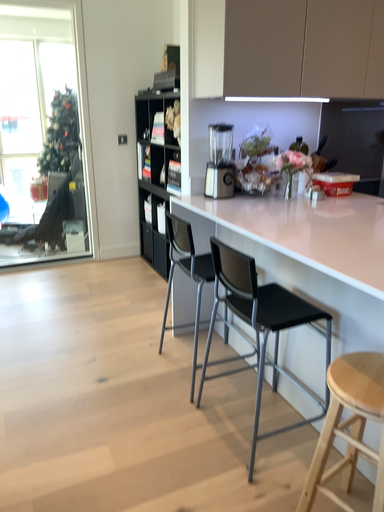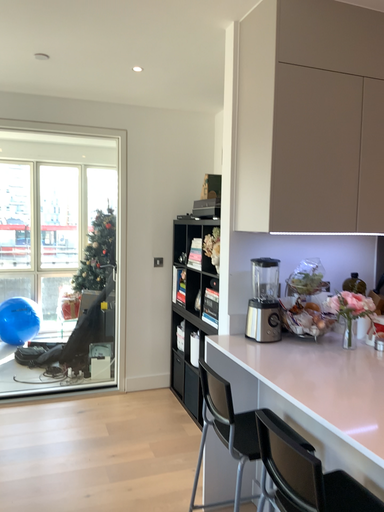
Question: How did the camera likely rotate when shooting the video?

Choices:
 (A) rotated upward
 (B) rotated downward

Answer: (A)